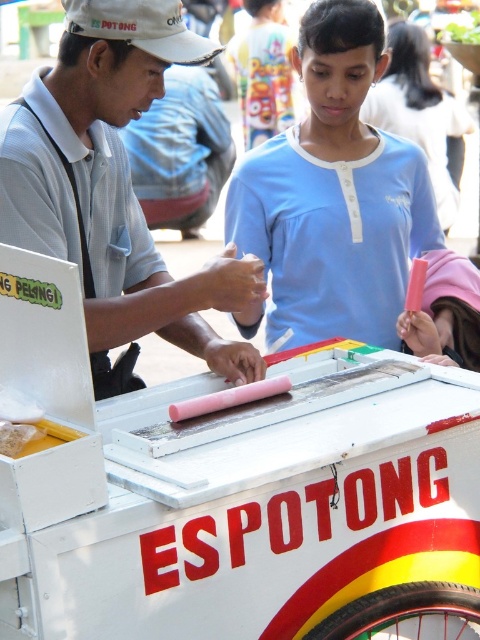
Question: Estimate the real-world distances between objects in this image. Which object is farther from the white matte baseball cap at upper left?

Choices:
 (A) matte pink ice cream at center
 (B) pink matte ice cream at center

Answer: (B)

Question: Can you confirm if matte pink ice cream at center is positioned above pink matte ice cream at center?

Choices:
 (A) no
 (B) yes

Answer: (A)

Question: Where is pink matte ice cream at center located in relation to white matte baseball cap at upper left in the image?

Choices:
 (A) below
 (B) above

Answer: (A)

Question: Which point is farther to the camera?

Choices:
 (A) white matte baseball cap at upper left
 (B) pink matte ice cream at center
 (C) matte pink ice cream at center

Answer: (B)

Question: Which object is positioned closest to the white matte baseball cap at upper left?

Choices:
 (A) pink matte ice cream at center
 (B) matte pink ice cream at center

Answer: (B)

Question: Is matte pink ice cream at center to the left of pink matte ice cream at center from the viewer's perspective?

Choices:
 (A) yes
 (B) no

Answer: (A)